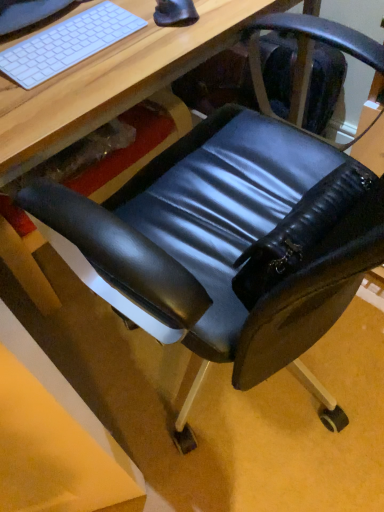
Question: Is white matte keyboard at upper left thinner than black rubber mouse at upper center?

Choices:
 (A) no
 (B) yes

Answer: (A)

Question: Does white matte keyboard at upper left have a greater width compared to black rubber mouse at upper center?

Choices:
 (A) no
 (B) yes

Answer: (B)

Question: Is white matte keyboard at upper left beside black rubber mouse at upper center?

Choices:
 (A) no
 (B) yes

Answer: (A)

Question: Does white matte keyboard at upper left lie in front of black rubber mouse at upper center?

Choices:
 (A) yes
 (B) no

Answer: (A)

Question: Does white matte keyboard at upper left have a smaller size compared to black rubber mouse at upper center?

Choices:
 (A) yes
 (B) no

Answer: (B)

Question: From their relative heights in the image, would you say black leather swivel chair at center is taller or shorter than black rubber mouse at upper center?

Choices:
 (A) short
 (B) tall

Answer: (B)

Question: Relative to black rubber mouse at upper center, is black leather swivel chair at center in front or behind?

Choices:
 (A) front
 (B) behind

Answer: (A)

Question: From a real-world perspective, is black leather swivel chair at center positioned above or below black rubber mouse at upper center?

Choices:
 (A) below
 (B) above

Answer: (A)

Question: Is black leather swivel chair at center situated inside black rubber mouse at upper center or outside?

Choices:
 (A) inside
 (B) outside

Answer: (B)

Question: Do you think white matte keyboard at upper left is within matte black chair at lower right, or outside of it?

Choices:
 (A) inside
 (B) outside

Answer: (A)

Question: Based on their positions, is white matte keyboard at upper left located to the left or right of matte black chair at lower right?

Choices:
 (A) right
 (B) left

Answer: (A)

Question: From the image's perspective, is white matte keyboard at upper left located above or below matte black chair at lower right?

Choices:
 (A) below
 (B) above

Answer: (B)

Question: From their relative heights in the image, would you say white matte keyboard at upper left is taller or shorter than matte black chair at lower right?

Choices:
 (A) short
 (B) tall

Answer: (A)

Question: Is white matte keyboard at upper left taller or shorter than black rubber mouse at upper center?

Choices:
 (A) tall
 (B) short

Answer: (B)

Question: Is white matte keyboard at upper left to the left or to the right of black rubber mouse at upper center in the image?

Choices:
 (A) right
 (B) left

Answer: (B)